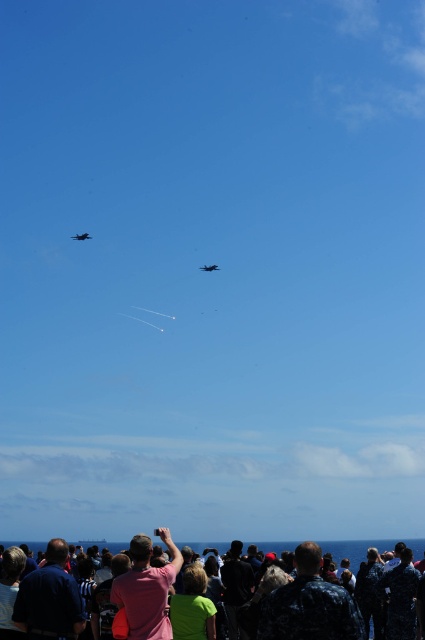
Question: Is pink fabric shirt at lower center positioned in front of shiny dark blue jet at center?

Choices:
 (A) no
 (B) yes

Answer: (B)

Question: Which object is positioned farthest from the navy uniform at lower right?

Choices:
 (A) dark blue uniform at lower center
 (B) shiny dark blue jet at center

Answer: (B)

Question: Is the position of pink fabric shirt at center less distant than that of dark blue uniform at lower center?

Choices:
 (A) no
 (B) yes

Answer: (B)

Question: Which of the following is the farthest from the observer?

Choices:
 (A) shiny dark blue jet at center
 (B) pink fabric shirt at lower center

Answer: (A)

Question: Which point is closer to the camera taking this photo?

Choices:
 (A) (305, 572)
 (B) (226, 572)
 (C) (189, 600)

Answer: (A)

Question: Can you confirm if navy uniform at lower right is wider than shiny dark blue jet at center?

Choices:
 (A) yes
 (B) no

Answer: (A)